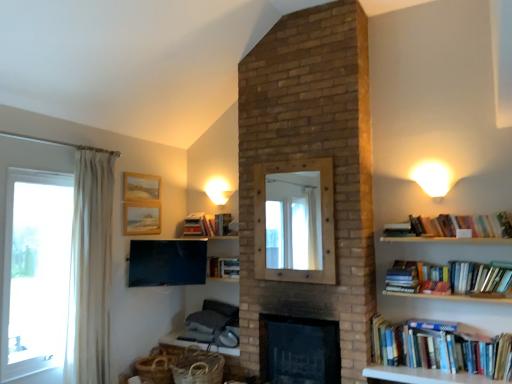
Question: Should I look upward or downward to see black brick fireplace at center?

Choices:
 (A) up
 (B) down

Answer: (B)

Question: Is hardcover books at right, acting as the first book starting from the right, smaller than wooden textured picture frame at upper left, which is counted as the first picture frame, starting from the bottom?

Choices:
 (A) yes
 (B) no

Answer: (B)

Question: From the image's perspective, is hardcover books at right, acting as the first book starting from the right, under wooden textured picture frame at upper left, which is counted as the first picture frame, starting from the bottom?

Choices:
 (A) yes
 (B) no

Answer: (B)

Question: Is hardcover books at right, which ranks as the 4th book in left-to-right order, facing away from wooden textured picture frame at upper left, arranged as the 2th picture frame when viewed from the top?

Choices:
 (A) no
 (B) yes

Answer: (A)

Question: Would you say hardcover books at right, which is the 3th book in back-to-front order, contains wooden textured picture frame at upper left, arranged as the 2th picture frame when viewed from the top?

Choices:
 (A) yes
 (B) no

Answer: (B)

Question: Considering the relative sizes of hardcover books at right, which is the 3th book in back-to-front order, and wooden textured picture frame at upper left, arranged as the 2th picture frame when viewed from the top, in the image provided, is hardcover books at right, which is the 3th book in back-to-front order, bigger than wooden textured picture frame at upper left, arranged as the 2th picture frame when viewed from the top,?

Choices:
 (A) yes
 (B) no

Answer: (A)

Question: From a real-world perspective, is hardcover books at right, which ranks as the fourth book in bottom-to-top order, physically below wooden textured picture frame at upper left, arranged as the 2th picture frame when viewed from the top?

Choices:
 (A) yes
 (B) no

Answer: (A)

Question: Can you confirm if wooden textured picture frame at upper left, which is counted as the first picture frame, starting from the bottom, is shorter than wooden picture frame at upper left, positioned as the 2th picture frame in bottom-to-top order?

Choices:
 (A) yes
 (B) no

Answer: (B)

Question: From the image's perspective, is wooden textured picture frame at upper left, which is counted as the first picture frame, starting from the bottom, on top of wooden picture frame at upper left, positioned as the 2th picture frame in bottom-to-top order?

Choices:
 (A) no
 (B) yes

Answer: (A)

Question: Is wooden textured picture frame at upper left, which is counted as the first picture frame, starting from the bottom, in front of wooden picture frame at upper left, marked as the 1th picture frame in a top-to-bottom arrangement?

Choices:
 (A) no
 (B) yes

Answer: (B)

Question: Could you tell me if wooden textured picture frame at upper left, arranged as the 2th picture frame when viewed from the top, is turned towards wooden picture frame at upper left, positioned as the 2th picture frame in bottom-to-top order?

Choices:
 (A) yes
 (B) no

Answer: (B)

Question: Is wooden textured picture frame at upper left, arranged as the 2th picture frame when viewed from the top, turned away from wooden picture frame at upper left, positioned as the 2th picture frame in bottom-to-top order?

Choices:
 (A) no
 (B) yes

Answer: (A)

Question: Is wooden textured picture frame at upper left, arranged as the 2th picture frame when viewed from the top, located outside wooden picture frame at upper left, positioned as the 2th picture frame in bottom-to-top order?

Choices:
 (A) no
 (B) yes

Answer: (B)

Question: From a real-world perspective, is wooden mirror at center on white fabric curtain at left?

Choices:
 (A) yes
 (B) no

Answer: (A)